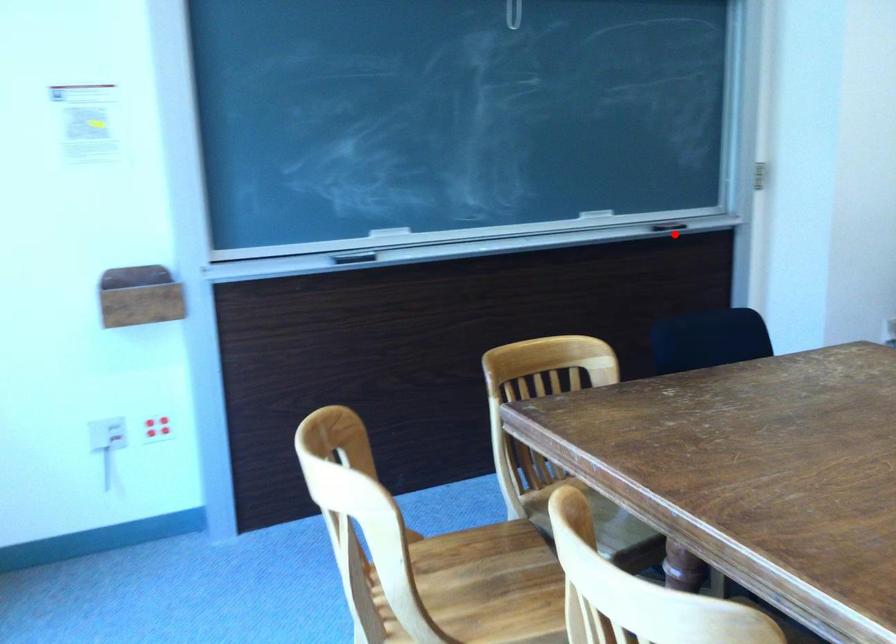
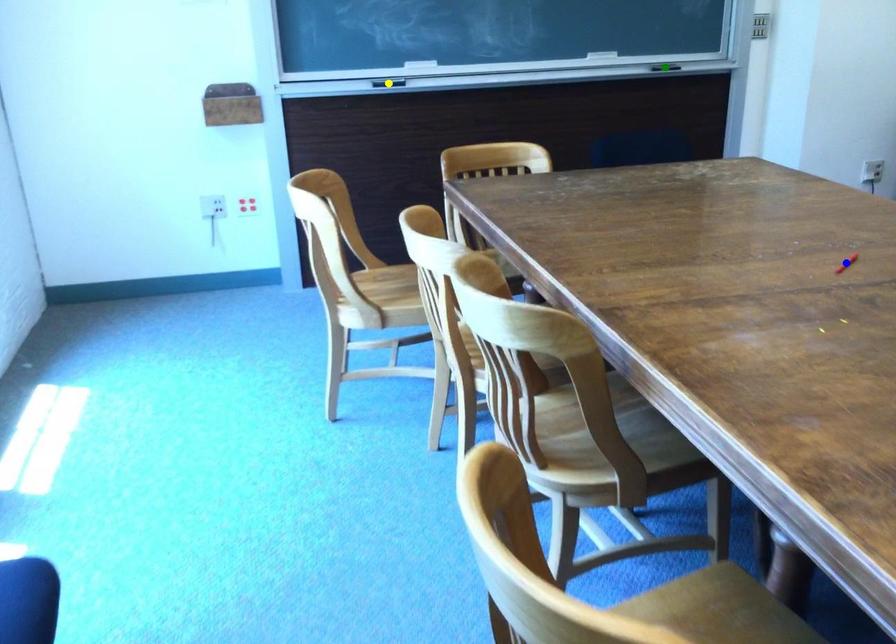
Question: I am providing you with two images of the same scene from different viewpoints. A red point is marked on the first image. You are given multiple points on the second image. Can you choose the point in image 2 that corresponds to the point in image 1?

Choices:
 (A) yellow point
 (B) blue point
 (C) green point

Answer: (C)